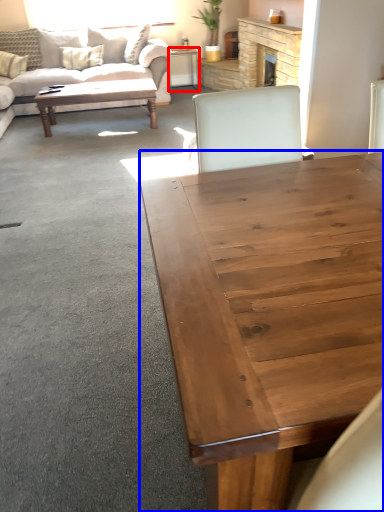
Question: Which object is further to the camera taking this photo, desk (highlighted by a red box) or coffee table (highlighted by a blue box)?

Choices:
 (A) desk
 (B) coffee table

Answer: (A)